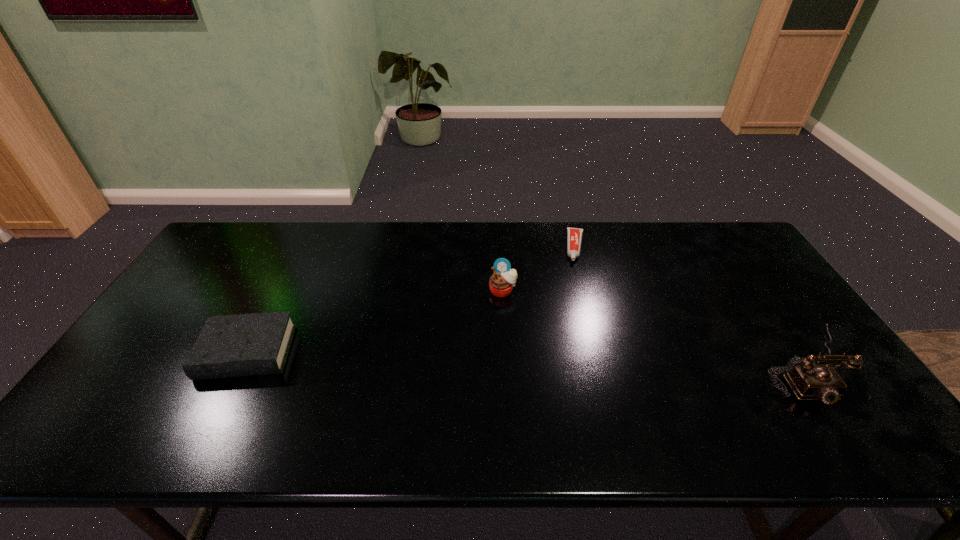
In the image, there is a desktop. Identify the location of vacant space at the near edge. click(x=429, y=409).

This screenshot has height=540, width=960. Find the location of `free space at the right edge`. free space at the right edge is located at coordinates pos(782,317).

In the image, there is a desktop. At what (x,y) coordinates should I click in order to perform the action: click on free space at the near left corner. Please return your answer as a coordinate pair (x, y). The image size is (960, 540). Looking at the image, I should click on (121, 403).

Identify the location of vacant region at the far right corner of the desktop. (726, 225).

Where is `empty location between the farthest object and the Bible`? The width and height of the screenshot is (960, 540). empty location between the farthest object and the Bible is located at coordinates (411, 300).

At what (x,y) coordinates should I click in order to perform the action: click on free space between the third nearest object and the farthest object. Please return your answer as a coordinate pair (x, y). This screenshot has height=540, width=960. Looking at the image, I should click on (540, 269).

Identify the location of free space between the rightmost object and the leftmost object. The image size is (960, 540). (526, 359).

This screenshot has width=960, height=540. What are the coordinates of `free spot between the telephone and the third tallest object` in the screenshot? It's located at coord(526,359).

You are a GUI agent. You are given a task and a screenshot of the screen. Output one action in this format:
    pyautogui.click(x=<x>, y=<y>)
    Task: Click on the vacant space that is in between the second object from right to left and the leftmost object
    
    Given the screenshot: What is the action you would take?
    pyautogui.click(x=411, y=300)

You are a GUI agent. You are given a task and a screenshot of the screen. Output one action in this format:
    pyautogui.click(x=<x>, y=<y>)
    Task: Click on the vacant point located between the shortest object and the third nearest object
    Image resolution: width=960 pixels, height=540 pixels.
    Given the screenshot: What is the action you would take?
    pyautogui.click(x=540, y=269)